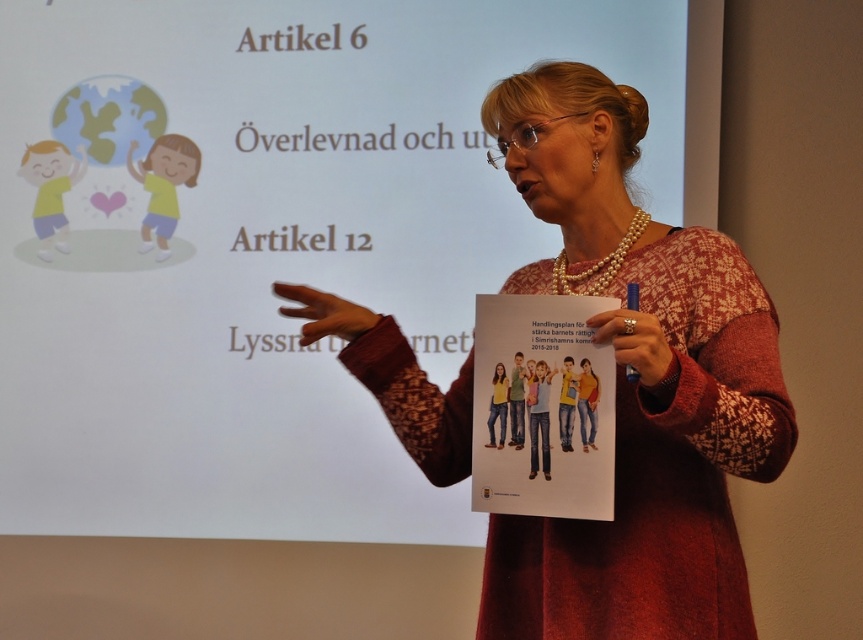
You are attending a lecture and want to take a photo of the projection screen. The camera you are using has a focus range of 10 feet. Is the distance from your camera to the point on the screen at coordinates point (654, 141) within the focus range?

The distance between point (654, 141) and the camera is 11.54 feet, which exceeds the camera focus range of 10 feet. Therefore, the camera cannot focus on that point.

You are a photographer at the back of the room. You want to take a photo of the knitted sweater at center without the white paper at center blocking the view. Is it possible to do so?

The knitted sweater at center is behind the white paper at center, so it is not possible to take a photo of the knitted sweater at center without the white paper at center blocking the view.